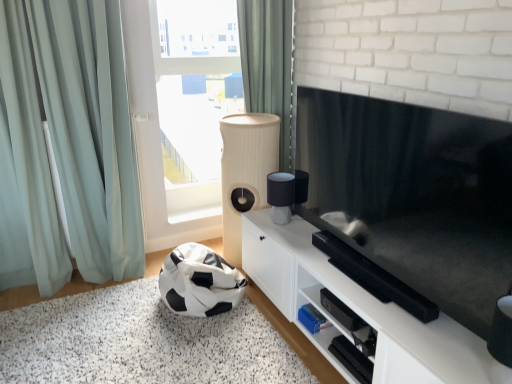
Question: From a real-world perspective, is black and white fabric bean bag at lower left over beige ribbed speaker at center?

Choices:
 (A) no
 (B) yes

Answer: (A)

Question: Is beige ribbed speaker at center inside black and white fabric bean bag at lower left?

Choices:
 (A) yes
 (B) no

Answer: (B)

Question: Is black and white fabric bean bag at lower left positioned before beige ribbed speaker at center?

Choices:
 (A) no
 (B) yes

Answer: (B)

Question: Is black and white fabric bean bag at lower left smaller than beige ribbed speaker at center?

Choices:
 (A) no
 (B) yes

Answer: (B)

Question: Is black and white fabric bean bag at lower left thinner than beige ribbed speaker at center?

Choices:
 (A) yes
 (B) no

Answer: (B)

Question: Is the depth of black and white fabric bean bag at lower left greater than that of beige ribbed speaker at center?

Choices:
 (A) no
 (B) yes

Answer: (A)

Question: Is black and white fabric bean bag at lower left aimed at black and white fabric bean bag at lower left?

Choices:
 (A) yes
 (B) no

Answer: (A)

Question: From the image's perspective, is black and white fabric bean bag at lower left above black and white fabric bean bag at lower left?

Choices:
 (A) no
 (B) yes

Answer: (B)

Question: Does black and white fabric bean bag at lower left have a greater height compared to black and white fabric bean bag at lower left?

Choices:
 (A) no
 (B) yes

Answer: (B)

Question: Is black and white fabric bean bag at lower left next to black and white fabric bean bag at lower left and touching it?

Choices:
 (A) no
 (B) yes

Answer: (A)

Question: From a real-world perspective, is black and white fabric bean bag at lower left on top of black and white fabric bean bag at lower left?

Choices:
 (A) no
 (B) yes

Answer: (B)

Question: Is black and white fabric bean bag at lower left outside black and white fabric bean bag at lower left?

Choices:
 (A) yes
 (B) no

Answer: (A)

Question: Is black and white fabric bean bag at lower left wider than green fabric curtain at upper center, arranged as the second curtain when viewed from the left?

Choices:
 (A) no
 (B) yes

Answer: (B)